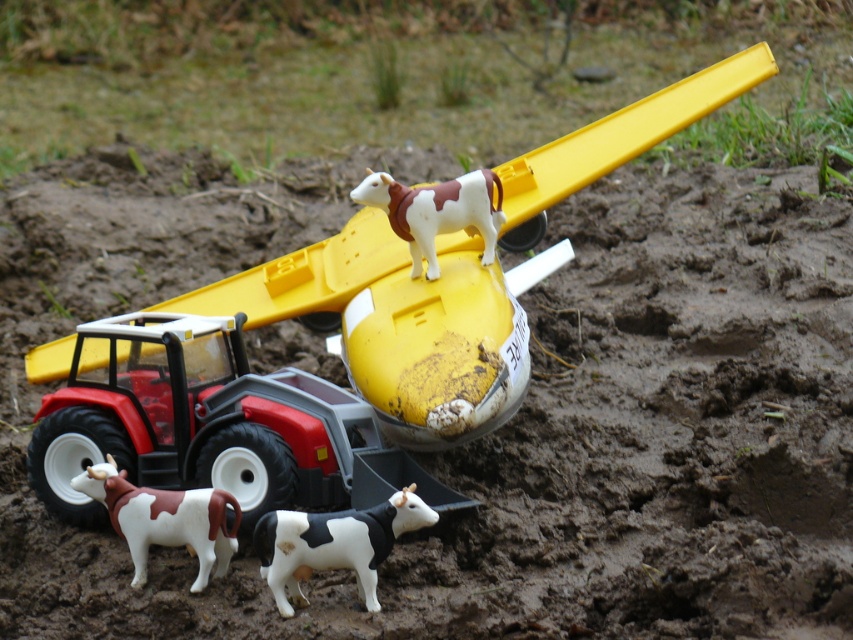
The image size is (853, 640). What do you see at coordinates (289, 374) in the screenshot?
I see `yellow plastic airplane at center` at bounding box center [289, 374].

Who is more distant from viewer, (457, 321) or (325, 538)?

The point (457, 321) is more distant.

Where is `yellow plastic airplane at center`? yellow plastic airplane at center is located at coordinates (289, 374).

Can you confirm if yellow plastic airplane at center is smaller than brown and white plastic cow at upper center?

No.

Does yellow plastic airplane at center have a larger size compared to brown and white plastic cow at upper center?

Yes.

Does point (378, 492) come farther from viewer compared to point (482, 208)?

That is False.

Image resolution: width=853 pixels, height=640 pixels. I want to click on yellow plastic airplane at center, so click(289, 374).

Between brown and white plastic cow at lower left and brown and white plastic cow at upper center, which one is positioned higher?

brown and white plastic cow at upper center is higher up.

Does point (213, 497) lie in front of point (456, 195)?

Yes, it is in front of point (456, 195).

Identify the location of brown and white plastic cow at lower left. (164, 518).